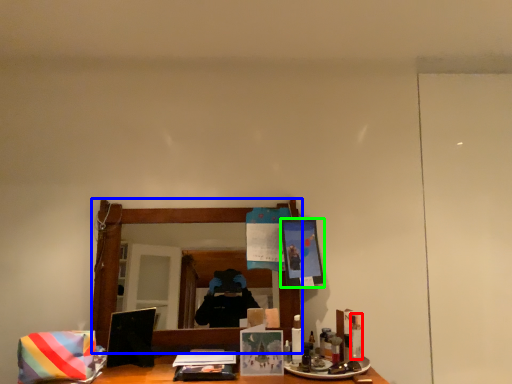
Question: Estimate the real-world distances between objects in this image. Which object is farther from toiletry (highlighted by a red box), mirror (highlighted by a blue box) or picture frame (highlighted by a green box)?

Choices:
 (A) mirror
 (B) picture frame

Answer: (A)